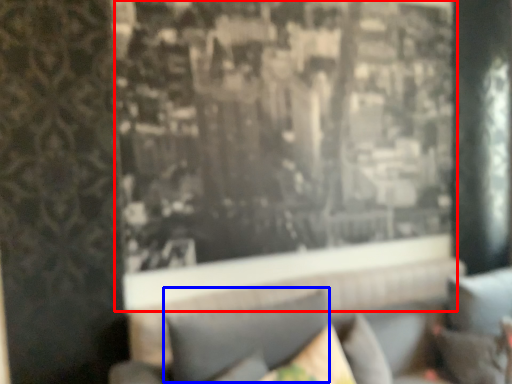
Question: Which object is further to the camera taking this photo, window (highlighted by a red box) or pillow (highlighted by a blue box)?

Choices:
 (A) window
 (B) pillow

Answer: (A)